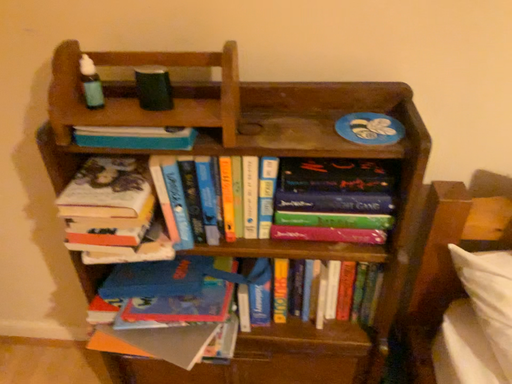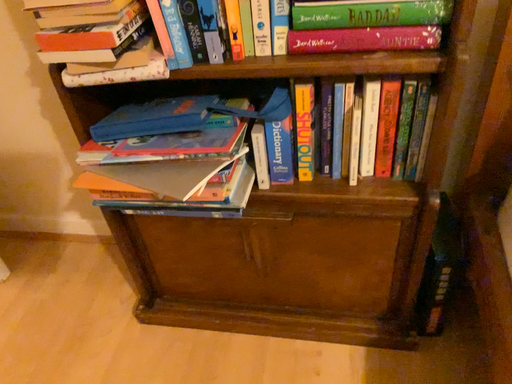
Question: How did the camera likely rotate when shooting the video?

Choices:
 (A) rotated right
 (B) rotated left

Answer: (B)